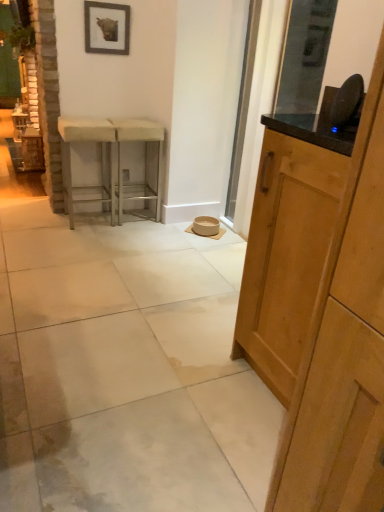
Question: From the image's perspective, is light wood cabinet at right located beneath white fabric stool at left, the 1th stool when ordered from left to right?

Choices:
 (A) yes
 (B) no

Answer: (A)

Question: From the image's perspective, is light wood cabinet at right on top of white fabric stool at left, which is counted as the 2th stool, starting from the right?

Choices:
 (A) no
 (B) yes

Answer: (A)

Question: Can you confirm if light wood cabinet at right is taller than white fabric stool at left, which is counted as the 2th stool, starting from the right?

Choices:
 (A) yes
 (B) no

Answer: (A)

Question: Is light wood cabinet at right facing away from white fabric stool at left, the 1th stool when ordered from left to right?

Choices:
 (A) yes
 (B) no

Answer: (B)

Question: Does light wood cabinet at right appear on the left side of white fabric stool at left, which is counted as the 2th stool, starting from the right?

Choices:
 (A) no
 (B) yes

Answer: (A)

Question: In the image, is metallic silver stool at center, marked as the 2th stool in a left-to-right arrangement, positioned in front of or behind light wood cabinet at right?

Choices:
 (A) behind
 (B) front

Answer: (A)

Question: From the image's perspective, is metallic silver stool at center, marked as the 2th stool in a left-to-right arrangement, located above or below light wood cabinet at right?

Choices:
 (A) below
 (B) above

Answer: (B)

Question: Considering the positions of metallic silver stool at center, marked as the 1th stool in a right-to-left arrangement, and light wood cabinet at right in the image, is metallic silver stool at center, marked as the 1th stool in a right-to-left arrangement, bigger or smaller than light wood cabinet at right?

Choices:
 (A) small
 (B) big

Answer: (A)

Question: Looking at their shapes, would you say metallic silver stool at center, marked as the 1th stool in a right-to-left arrangement, is wider or thinner than light wood cabinet at right?

Choices:
 (A) wide
 (B) thin

Answer: (B)

Question: Is point (79, 135) closer or farther from the camera than point (117, 124)?

Choices:
 (A) closer
 (B) farther

Answer: (A)

Question: In terms of height, does white fabric stool at left, the 1th stool when ordered from left to right, look taller or shorter compared to metallic silver stool at center, marked as the 2th stool in a left-to-right arrangement?

Choices:
 (A) tall
 (B) short

Answer: (B)

Question: From the image's perspective, is white fabric stool at left, the 1th stool when ordered from left to right, located above or below metallic silver stool at center, marked as the 2th stool in a left-to-right arrangement?

Choices:
 (A) above
 (B) below

Answer: (B)

Question: Is white fabric stool at left, the 1th stool when ordered from left to right, wider or thinner than metallic silver stool at center, marked as the 1th stool in a right-to-left arrangement?

Choices:
 (A) wide
 (B) thin

Answer: (A)

Question: In the image, is white polished concrete at center positioned in front of or behind metallic silver stool at center, marked as the 2th stool in a left-to-right arrangement?

Choices:
 (A) front
 (B) behind

Answer: (A)

Question: Choose the correct answer: Is white polished concrete at center inside metallic silver stool at center, marked as the 2th stool in a left-to-right arrangement, or outside it?

Choices:
 (A) inside
 (B) outside

Answer: (B)